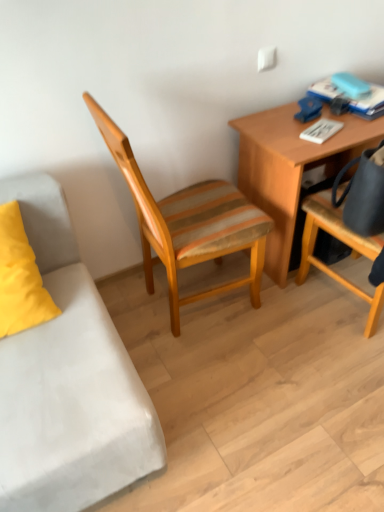
Identify the location of vacant area to the right of woodenchair at center, which is the 1th chair from left to right. The height and width of the screenshot is (512, 384). (301, 332).